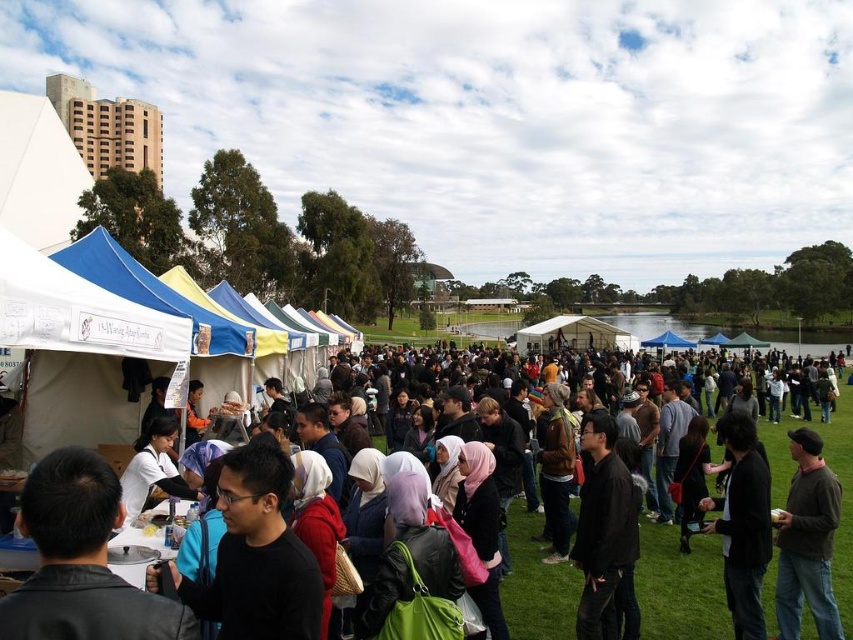
Question: Can you confirm if black matte jacket at center is bigger than black leather jacket at lower right?

Choices:
 (A) yes
 (B) no

Answer: (A)

Question: Estimate the real-world distances between objects in this image. Which object is closer to the black leather jacket at lower right?

Choices:
 (A) black matte jacket at center
 (B) brown leather jacket at lower right

Answer: (B)

Question: Is brown leather jacket at lower right bigger than black leather jacket at lower right?

Choices:
 (A) no
 (B) yes

Answer: (A)

Question: Which object is farther from the camera taking this photo?

Choices:
 (A) brown leather jacket at lower right
 (B) black matte jacket at center
 (C) black leather jacket at lower right

Answer: (B)

Question: Which is farther from the black matte jacket at center?

Choices:
 (A) brown leather jacket at lower right
 (B) black fabric crowd at center

Answer: (A)

Question: Considering the relative positions of brown leather jacket at lower right and black leather jacket at lower right in the image provided, where is brown leather jacket at lower right located with respect to black leather jacket at lower right?

Choices:
 (A) right
 (B) left

Answer: (A)